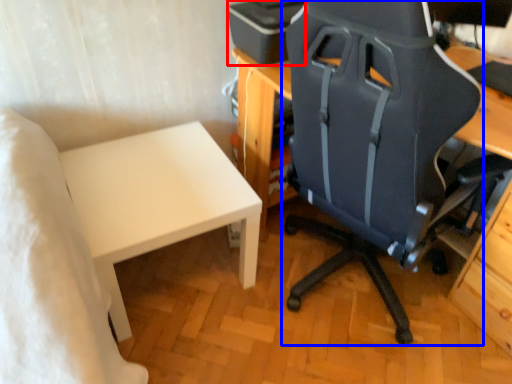
Question: Which object appears farthest to the camera in this image, printer (highlighted by a red box) or chair (highlighted by a blue box)?

Choices:
 (A) printer
 (B) chair

Answer: (A)